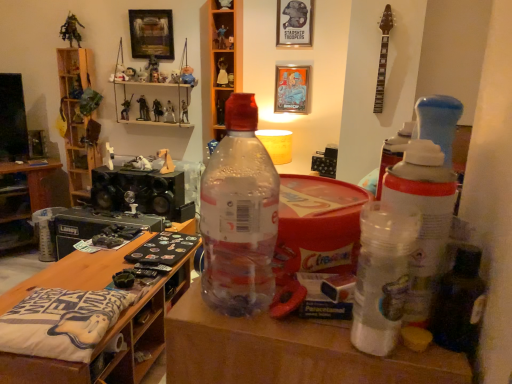
Question: Based on their positions, is metallic figure at shelf center, the eleventh toy positioned from the right, located to the left or right of plastic figurines at upper center, arranged as the seventh toy when viewed from the left?

Choices:
 (A) right
 (B) left

Answer: (A)

Question: Considering the positions of metallic figure at shelf center, marked as the 8th toy in a left-to-right arrangement, and plastic figurines at upper center, arranged as the seventh toy when viewed from the left, in the image, is metallic figure at shelf center, marked as the 8th toy in a left-to-right arrangement, bigger or smaller than plastic figurines at upper center, arranged as the seventh toy when viewed from the left,?

Choices:
 (A) small
 (B) big

Answer: (A)

Question: Estimate the real-world distances between objects in this image. Which object is farther from the plush toy at upper center, the fourteenth toy viewed from the right?

Choices:
 (A) plastic toy figure at upper center, arranged as the 6th toy when viewed from the right
 (B) wooden shelf at left, the 1th shelf viewed from the left
 (C) white fabric dog at center, the thirteenth toy viewed from the right
 (D) transparent plastic bottle at center
 (E) metallic figure at shelf center, marked as the 8th toy in a left-to-right arrangement

Answer: (D)

Question: Based on their relative distances, which object is nearer to the wooden shelf at left, acting as the second shelf starting from the right?

Choices:
 (A) white plastic figurine at upper center, positioned as the 14th toy in left-to-right order
 (B) plastic toy figure at upper center, arranged as the 6th toy when viewed from the right
 (C) plush toy at upper center, arranged as the 11th toy when viewed from the left
 (D) metallic silver toy at upper center, which appears as the 17th toy when viewed from the right
 (E) metallic figure at shelf center, the eleventh toy positioned from the right

Answer: (D)